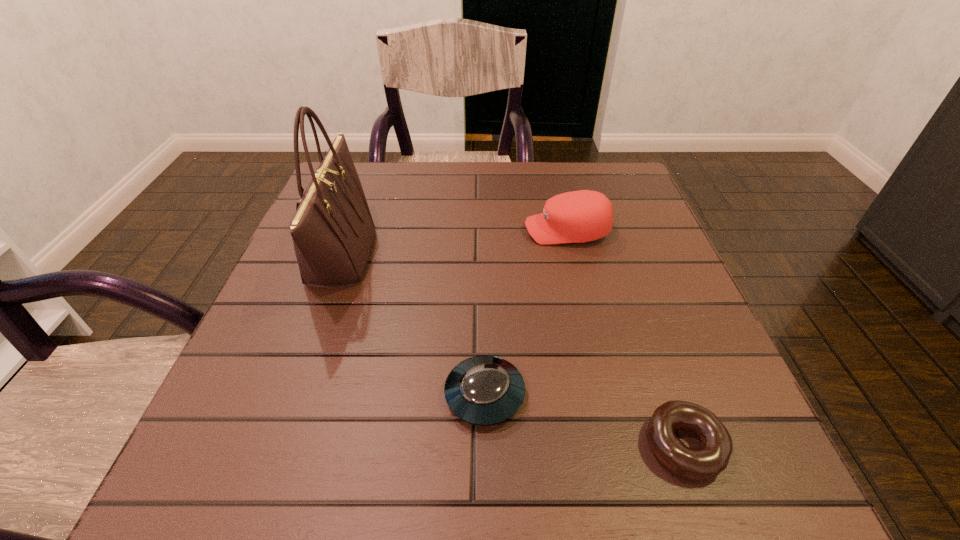
You are a GUI agent. You are given a task and a screenshot of the screen. Output one action in this format:
    pyautogui.click(x=<x>, y=<y>)
    Task: Click on the vacant space at the right edge of the desktop
    This screenshot has width=960, height=540.
    Given the screenshot: What is the action you would take?
    pyautogui.click(x=626, y=281)

In the image, there is a desktop. At what (x,y) coordinates should I click in order to perform the action: click on vacant space at the far left corner. Please return your answer as a coordinate pair (x, y). This screenshot has height=540, width=960. Looking at the image, I should click on (368, 169).

The width and height of the screenshot is (960, 540). I want to click on free space at the near left corner of the desktop, so click(x=261, y=483).

Locate an element on the screen. Image resolution: width=960 pixels, height=540 pixels. vacant space at the far right corner is located at coordinates (585, 181).

This screenshot has width=960, height=540. Identify the location of free space between the leftmost object and the third shortest object. (454, 243).

Find the location of `free spot between the tallest object and the third shortest object`. free spot between the tallest object and the third shortest object is located at coordinates (454, 243).

The image size is (960, 540). In order to click on free space between the third shortest object and the doughnut in this screenshot , I will do `click(625, 338)`.

Find the location of `vacant area that lies between the saucer and the handbag`. vacant area that lies between the saucer and the handbag is located at coordinates (413, 325).

Find the location of a particular element. blank region between the leftmost object and the doughnut is located at coordinates click(x=512, y=350).

You are a GUI agent. You are given a task and a screenshot of the screen. Output one action in this format:
    pyautogui.click(x=<x>, y=<y>)
    Task: Click on the free space between the doughnut and the cap
    The height and width of the screenshot is (540, 960).
    Given the screenshot: What is the action you would take?
    pyautogui.click(x=625, y=338)